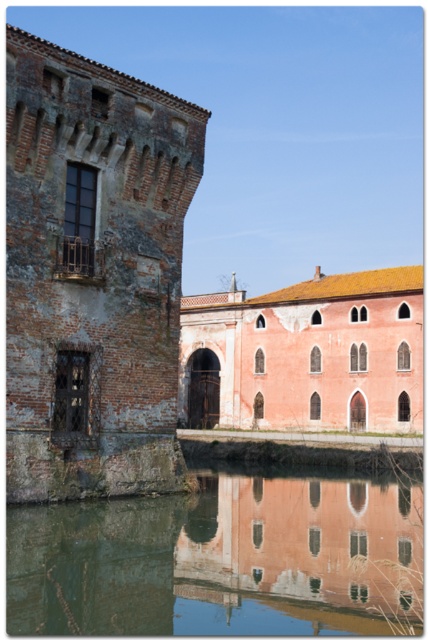
You are standing on the dock near the greenish reflective water at lower center and want to walk to the brick wall tower at left. Which direction should you head towards?

You should head towards the left because the brick wall tower at left is to the left of the greenish reflective water at lower center.

What is the spatial relationship between the brick wall tower at left and the point represented by coordinates point (x=92, y=275)?

The brick wall tower at left is represented by point (x=92, y=275).

You are a tourist standing at the edge of the canal looking at the scene. You notice the brick wall tower at left and the greenish reflective water at lower center. Which object appears narrower from your viewpoint?

The brick wall tower at left appears narrower because it has a lesser width compared to the greenish reflective water at lower center.